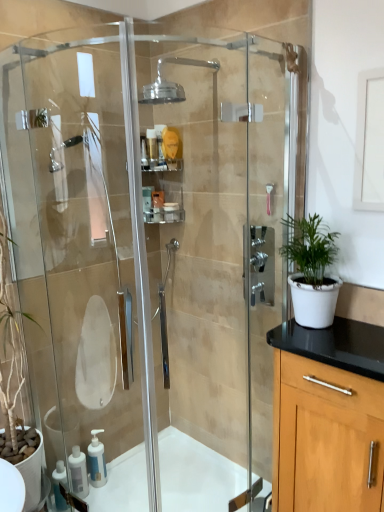
Where is `free point to the right of white plastic soap dispenser at lower left, the first soap dispenser in the right-to-left sequence`? free point to the right of white plastic soap dispenser at lower left, the first soap dispenser in the right-to-left sequence is located at coordinates (124, 488).